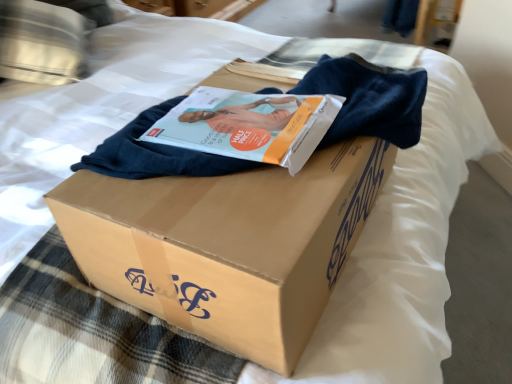
Question: Does matte paper magazine at center appear on the right side of metallic silver pillow at upper left?

Choices:
 (A) yes
 (B) no

Answer: (A)

Question: Considering the relative sizes of matte paper magazine at center and metallic silver pillow at upper left in the image provided, is matte paper magazine at center bigger than metallic silver pillow at upper left?

Choices:
 (A) yes
 (B) no

Answer: (B)

Question: Is matte paper magazine at center placed right next to metallic silver pillow at upper left?

Choices:
 (A) yes
 (B) no

Answer: (B)

Question: Can you confirm if matte paper magazine at center is positioned to the left of metallic silver pillow at upper left?

Choices:
 (A) yes
 (B) no

Answer: (B)

Question: From the image's perspective, is matte paper magazine at center on top of metallic silver pillow at upper left?

Choices:
 (A) no
 (B) yes

Answer: (A)

Question: Does matte paper magazine at center contain metallic silver pillow at upper left?

Choices:
 (A) yes
 (B) no

Answer: (B)

Question: Does metallic silver pillow at upper left have a larger size compared to matte paper magazine at center?

Choices:
 (A) no
 (B) yes

Answer: (B)

Question: Does metallic silver pillow at upper left have a smaller size compared to matte paper magazine at center?

Choices:
 (A) yes
 (B) no

Answer: (B)

Question: Considering the relative positions of metallic silver pillow at upper left and matte paper magazine at center in the image provided, is metallic silver pillow at upper left behind matte paper magazine at center?

Choices:
 (A) no
 (B) yes

Answer: (B)

Question: Is metallic silver pillow at upper left facing towards matte paper magazine at center?

Choices:
 (A) no
 (B) yes

Answer: (A)

Question: Does metallic silver pillow at upper left have a lesser height compared to matte paper magazine at center?

Choices:
 (A) no
 (B) yes

Answer: (A)

Question: From a real-world perspective, is metallic silver pillow at upper left physically above matte paper magazine at center?

Choices:
 (A) no
 (B) yes

Answer: (A)

Question: From the image's perspective, is matte paper magazine at center located above brown cardboard box at center?

Choices:
 (A) yes
 (B) no

Answer: (A)